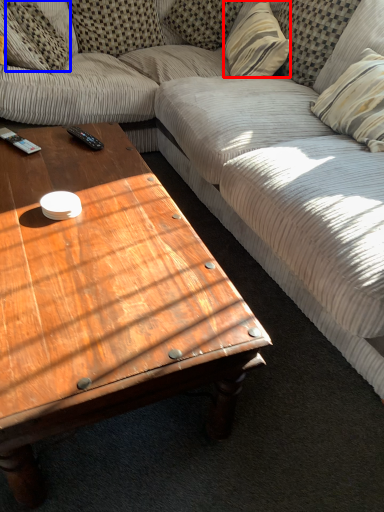
Question: Which of the following is the farthest to the observer, pillow (highlighted by a red box) or pillow (highlighted by a blue box)?

Choices:
 (A) pillow
 (B) pillow

Answer: (B)